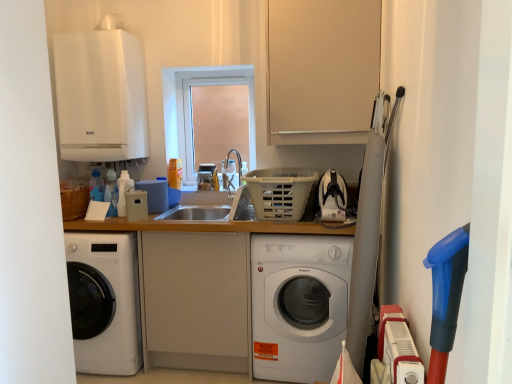
Question: From a real-world perspective, is transparent glass window at center located beneath wooden counter at center?

Choices:
 (A) yes
 (B) no

Answer: (B)

Question: Does transparent glass window at center appear on the right side of wooden counter at center?

Choices:
 (A) no
 (B) yes

Answer: (B)

Question: From the image's perspective, is transparent glass window at center beneath wooden counter at center?

Choices:
 (A) no
 (B) yes

Answer: (A)

Question: Is transparent glass window at center oriented away from wooden counter at center?

Choices:
 (A) yes
 (B) no

Answer: (B)

Question: Are transparent glass window at center and wooden counter at center located far from each other?

Choices:
 (A) yes
 (B) no

Answer: (A)

Question: From the image's perspective, is white plastic basket at center above or below transparent glass window at center?

Choices:
 (A) below
 (B) above

Answer: (A)

Question: In the image, is white plastic basket at center positioned in front of or behind transparent glass window at center?

Choices:
 (A) front
 (B) behind

Answer: (A)

Question: Is white plastic basket at center inside or outside of transparent glass window at center?

Choices:
 (A) outside
 (B) inside

Answer: (A)

Question: In terms of height, does white plastic basket at center look taller or shorter compared to transparent glass window at center?

Choices:
 (A) tall
 (B) short

Answer: (B)

Question: Choose the correct answer: Is beige matte cabinet at upper center inside white plastic basket at center or outside it?

Choices:
 (A) outside
 (B) inside

Answer: (A)

Question: From a real-world perspective, is beige matte cabinet at upper center physically located above or below white plastic basket at center?

Choices:
 (A) above
 (B) below

Answer: (A)

Question: Considering the positions of beige matte cabinet at upper center and white plastic basket at center in the image, is beige matte cabinet at upper center taller or shorter than white plastic basket at center?

Choices:
 (A) tall
 (B) short

Answer: (A)

Question: Considering the positions of point (271, 24) and point (267, 170), is point (271, 24) closer or farther from the camera than point (267, 170)?

Choices:
 (A) closer
 (B) farther

Answer: (A)

Question: Is beige plastic speaker at center, the 3th appliance viewed from the top, in front of or behind white matte boiler at upper left, which is the third appliance from right to left, in the image?

Choices:
 (A) front
 (B) behind

Answer: (A)

Question: Considering the positions of beige plastic speaker at center, which appears as the 2th appliance when viewed from the left, and white matte boiler at upper left, the second appliance positioned from the front, in the image, is beige plastic speaker at center, which appears as the 2th appliance when viewed from the left, wider or thinner than white matte boiler at upper left, the second appliance positioned from the front,?

Choices:
 (A) thin
 (B) wide

Answer: (A)